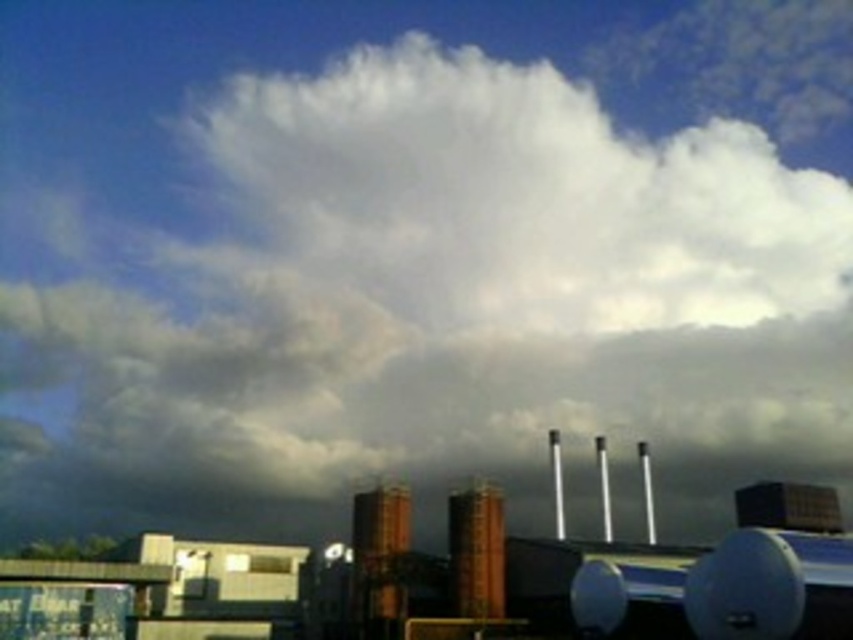
What are the coordinates of the brown brick chimney at center?

The coordinates of the brown brick chimney at center are at point (378, 561).

You are an engineer inspecting the satellite and the chimneys from the ground. You notice two points marked on your map at coordinates point [154,532] and point [398,547]. Which point is closer to you?

Point [154,532] is closer to you because it is further to the viewer than point [398,547].